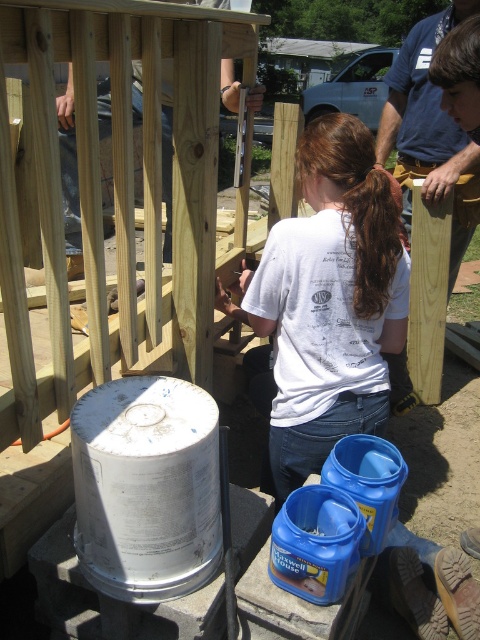
Who is taller, white cotton shirt at center or blue shirt at upper center?

white cotton shirt at center

Find the location of a particular element. The width and height of the screenshot is (480, 640). white cotton shirt at center is located at coordinates (297, 348).

At what (x,y) coordinates should I click in order to perform the action: click on white cotton shirt at center. Please return your answer as a coordinate pair (x, y). This screenshot has height=640, width=480. Looking at the image, I should click on (297, 348).